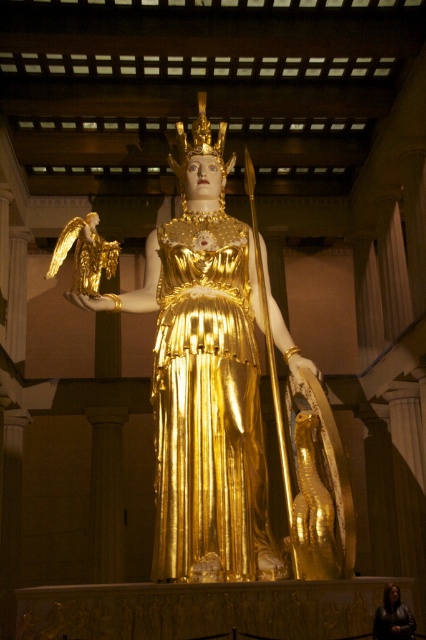
You are a security guard in the museum and need to place a protective barrier around the gold shiny robe at center and the dark brown leather jacket at lower right. Which object requires a wider barrier due to its size?

The gold shiny robe at center requires a wider barrier because it might be wider than the dark brown leather jacket at lower right.

You are an art conservator assessing the placement of the gold metallic statue at center and the gold shiny robe at center in a museum exhibit. Based on their sizes, which object would require a taller display stand to accommodate its height?

The gold metallic statue at center is much taller than the gold shiny robe at center, so it would require a taller display stand to accommodate its height.